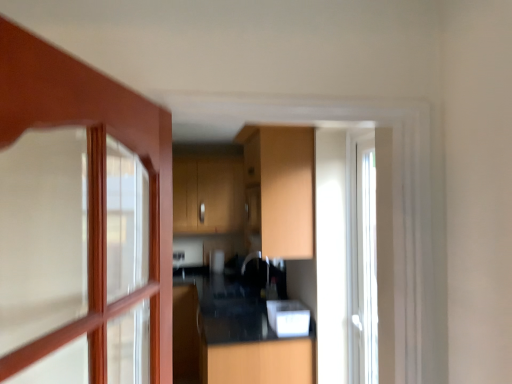
Question: Considering the relative positions of matte wood cabinet at center and black glossy counter top at center in the image provided, is matte wood cabinet at center to the right of black glossy counter top at center from the viewer's perspective?

Choices:
 (A) no
 (B) yes

Answer: (B)

Question: Can you confirm if matte wood cabinet at center is taller than black glossy counter top at center?

Choices:
 (A) yes
 (B) no

Answer: (B)

Question: From a real-world perspective, does matte wood cabinet at center sit lower than black glossy counter top at center?

Choices:
 (A) no
 (B) yes

Answer: (A)

Question: Is matte wood cabinet at center turned away from black glossy counter top at center?

Choices:
 (A) no
 (B) yes

Answer: (A)

Question: Is matte wood cabinet at center to the left of black glossy counter top at center from the viewer's perspective?

Choices:
 (A) no
 (B) yes

Answer: (A)

Question: From a real-world perspective, is matte wood cabinet at center on top of black glossy counter top at center?

Choices:
 (A) no
 (B) yes

Answer: (B)

Question: Is white glossy microwave at center smaller than matte wood cabinet at center?

Choices:
 (A) yes
 (B) no

Answer: (A)

Question: Can you confirm if white glossy microwave at center is positioned to the left of matte wood cabinet at center?

Choices:
 (A) yes
 (B) no

Answer: (B)

Question: Is white glossy microwave at center thinner than matte wood cabinet at center?

Choices:
 (A) no
 (B) yes

Answer: (B)

Question: Would you say white glossy microwave at center is outside matte wood cabinet at center?

Choices:
 (A) no
 (B) yes

Answer: (B)

Question: Does white glossy microwave at center have a larger size compared to matte wood cabinet at center?

Choices:
 (A) yes
 (B) no

Answer: (B)

Question: From a real-world perspective, is white glossy microwave at center located higher than matte wood cabinet at center?

Choices:
 (A) yes
 (B) no

Answer: (B)

Question: Is black glossy counter top at center facing away from matte wood cabinet at center?

Choices:
 (A) yes
 (B) no

Answer: (B)